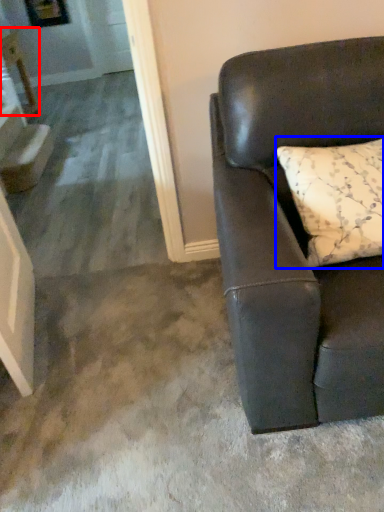
Question: Which of the following is the farthest to the observer, table (highlighted by a red box) or pillow (highlighted by a blue box)?

Choices:
 (A) table
 (B) pillow

Answer: (A)